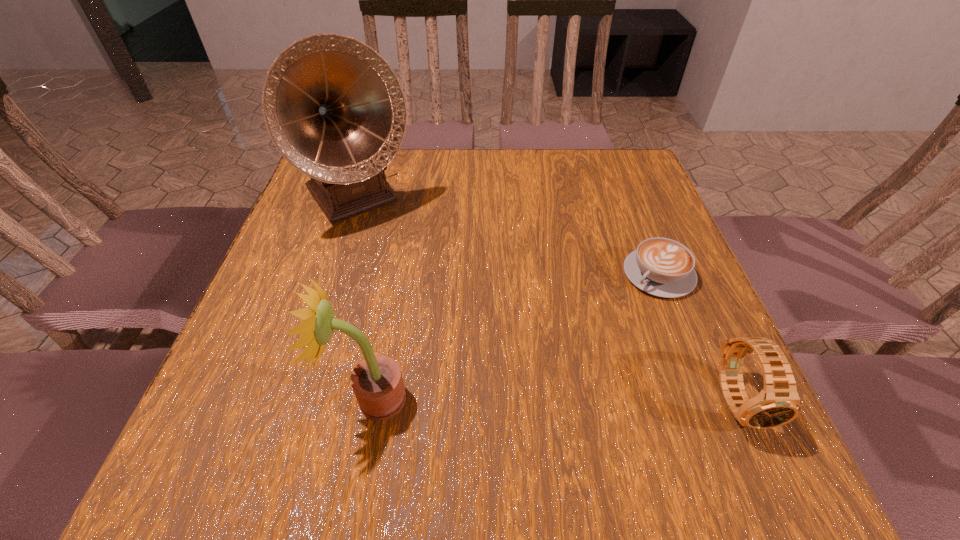
Identify the location of vacant space located 0.190m on the side of the shortest object with the handle. (582, 344).

At what (x,y) coordinates should I click in order to perform the action: click on vacant point located 0.180m on the side of the shortest object with the handle. Please return your answer as a coordinate pair (x, y). The height and width of the screenshot is (540, 960). Looking at the image, I should click on (586, 341).

In order to click on vacant space located on the horn of the farthest object in this screenshot , I will do `click(436, 296)`.

Identify the location of free point located 0.280m on the horn of the farthest object. (443, 306).

This screenshot has height=540, width=960. I want to click on vacant space located on the horn of the farthest object, so click(x=420, y=275).

This screenshot has width=960, height=540. I want to click on object present at the far edge, so click(335, 110).

The image size is (960, 540). I want to click on sunflower that is at the near edge, so click(x=377, y=382).

This screenshot has height=540, width=960. What are the coordinates of `watch positioned at the near edge` in the screenshot? It's located at (778, 403).

At what (x,y) coordinates should I click in order to perform the action: click on object that is at the left edge. Please return your answer as a coordinate pair (x, y). Looking at the image, I should click on (335, 110).

Find the location of `watch that is at the right edge`. watch that is at the right edge is located at coordinates (778, 403).